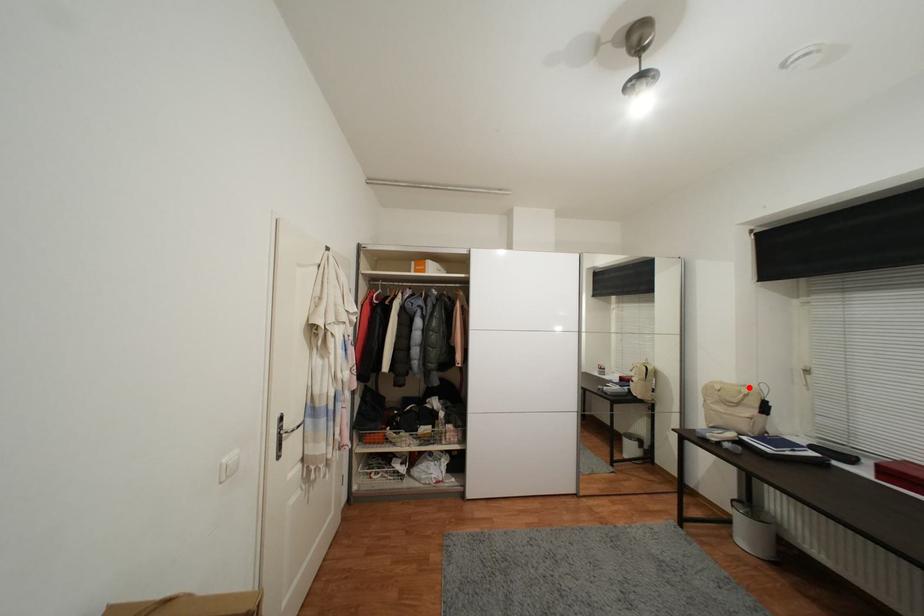
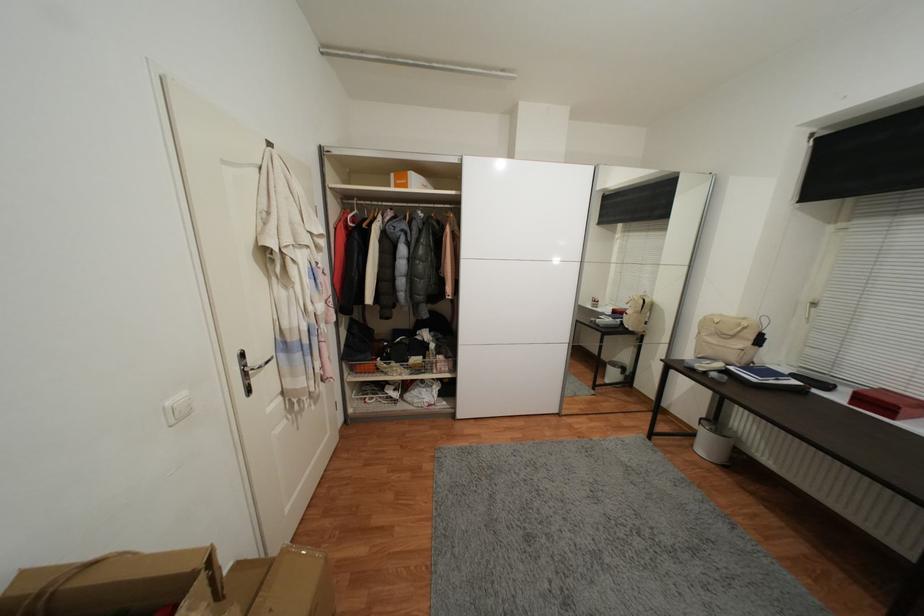
Find the pixel in the second image that matches the highlighted location in the first image.

(748, 321)